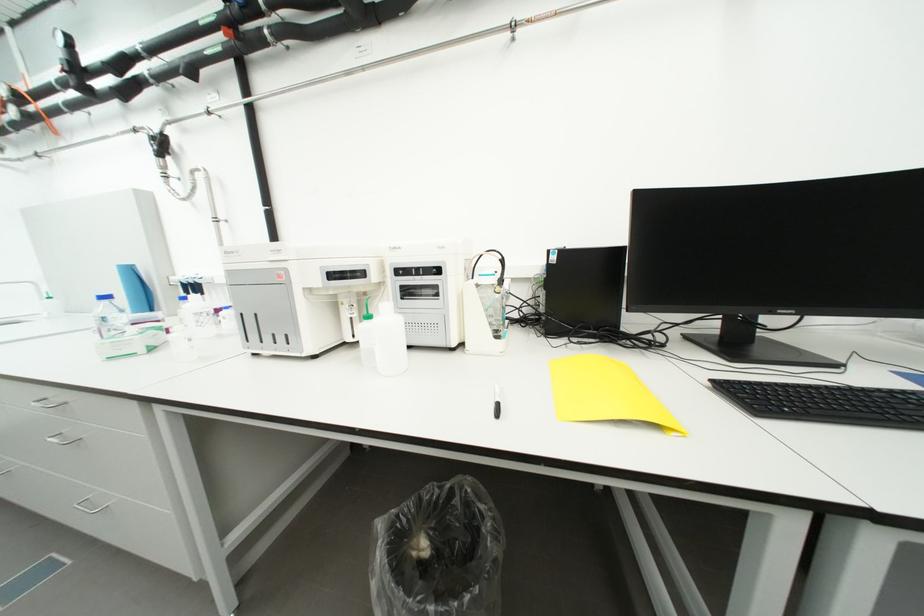
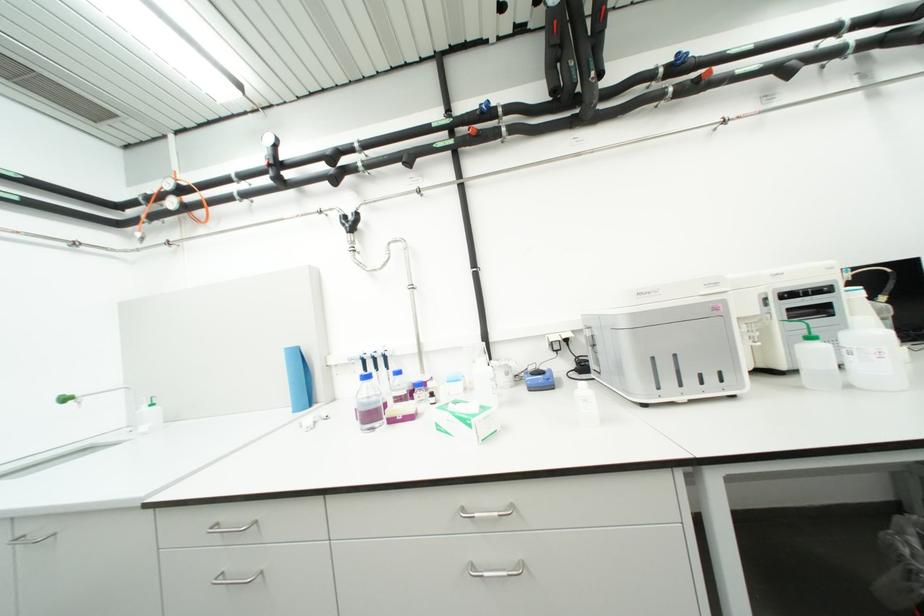
Question: I am providing you with two images of the same scene from different viewpoints. Please identify which objects are invisible in image2.

Choices:
 (A) black laundry hamper
 (B) green faucet handle
 (C) white squeeze bottle
 (D) black computer tower

Answer: (D)